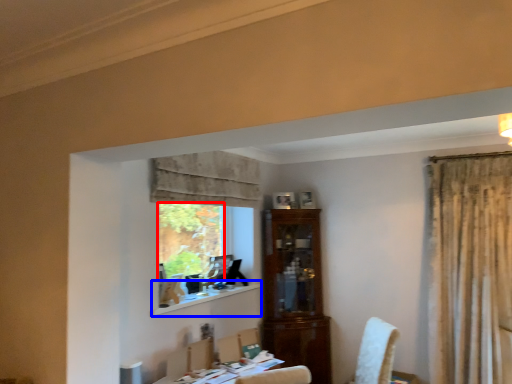
Question: Which of the following is the farthest to the observer, window screen (highlighted by a red box) or window sill (highlighted by a blue box)?

Choices:
 (A) window screen
 (B) window sill

Answer: (A)